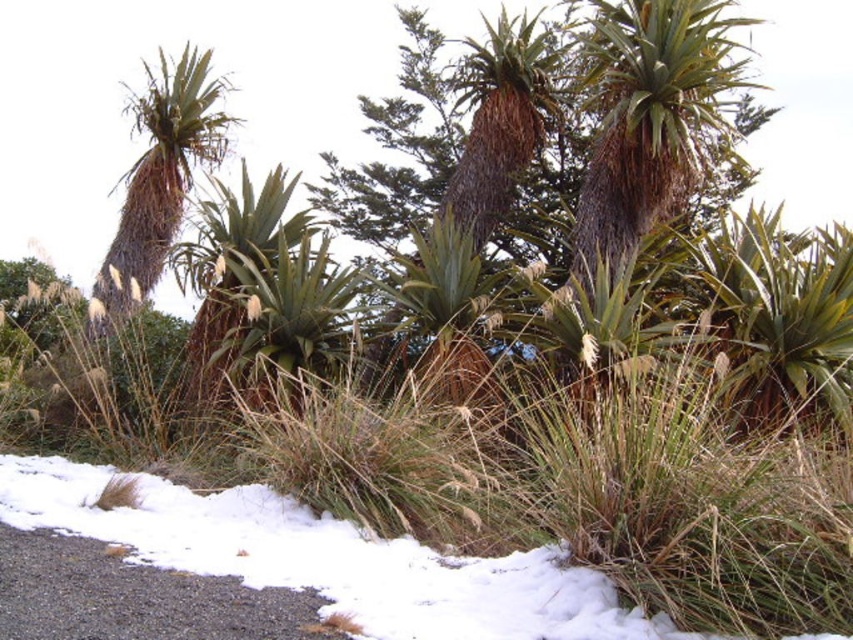
You are standing at the point marked by point (650, 115) in the image. Looking around, you see a brown textured palm tree at upper center. What direction is the brown textured palm tree at upper center located relative to your current position?

The brown textured palm tree at upper center is located directly in front of you since the point marks your position, and the tree is at the upper center of the image.

You are a botanist studying palm trees in a tropical region. You observe the brown textured palm tree at upper center and the green leafy palm tree at center. Which palm tree is taller?

The brown textured palm tree at upper center is much taller than the green leafy palm tree at center.